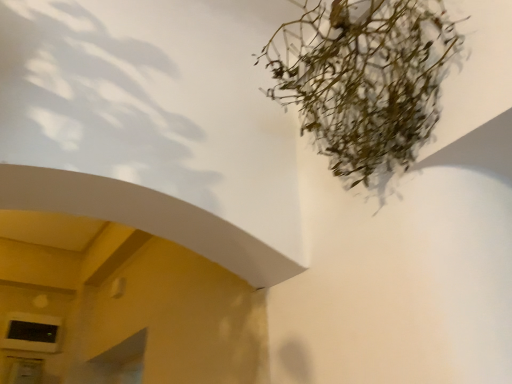
Question: From the image's perspective, relative to matte black window at lower left, is green matte plant at upper right above or below?

Choices:
 (A) below
 (B) above

Answer: (B)

Question: Is green matte plant at upper right wider or thinner than matte black window at lower left?

Choices:
 (A) wide
 (B) thin

Answer: (A)

Question: Is green matte plant at upper right to the left or to the right of matte black window at lower left in the image?

Choices:
 (A) right
 (B) left

Answer: (A)

Question: Does point (53, 349) appear closer or farther from the camera than point (378, 1)?

Choices:
 (A) closer
 (B) farther

Answer: (B)

Question: Considering the positions of matte black window at lower left and green matte plant at upper right in the image, is matte black window at lower left wider or thinner than green matte plant at upper right?

Choices:
 (A) wide
 (B) thin

Answer: (B)

Question: Considering their positions, is matte black window at lower left located in front of or behind green matte plant at upper right?

Choices:
 (A) behind
 (B) front

Answer: (A)

Question: In terms of height, does matte black window at lower left look taller or shorter compared to green matte plant at upper right?

Choices:
 (A) tall
 (B) short

Answer: (B)